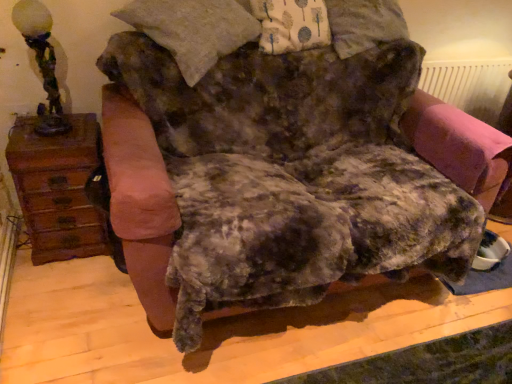
Question: From their relative heights in the image, would you say antique bronze lamp at left is taller or shorter than pink fabric swivel chair at right?

Choices:
 (A) short
 (B) tall

Answer: (B)

Question: In the image, is antique bronze lamp at left positioned in front of or behind pink fabric swivel chair at right?

Choices:
 (A) front
 (B) behind

Answer: (A)

Question: Estimate the real-world distances between objects in this image. Which object is closer to the antique bronze lamp at left?

Choices:
 (A) pink plastic radiator at upper right
 (B) brown wood dresser at left
 (C) pink fabric swivel chair at right

Answer: (B)

Question: Considering the real-world distances, which object is farthest from the antique bronze lamp at left?

Choices:
 (A) pink plastic radiator at upper right
 (B) pink fabric swivel chair at right
 (C) brown wood dresser at left

Answer: (A)